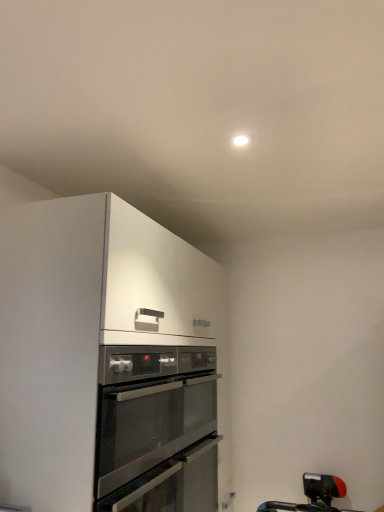
Image resolution: width=384 pixels, height=512 pixels. Describe the element at coordinates (151, 408) in the screenshot. I see `stainless steel oven at center` at that location.

This screenshot has height=512, width=384. Identify the location of stainless steel oven at center. (151, 408).

At what (x,y) coordinates should I click in order to perform the action: click on stainless steel oven at center. Please return your answer as a coordinate pair (x, y). Looking at the image, I should click on (151, 408).